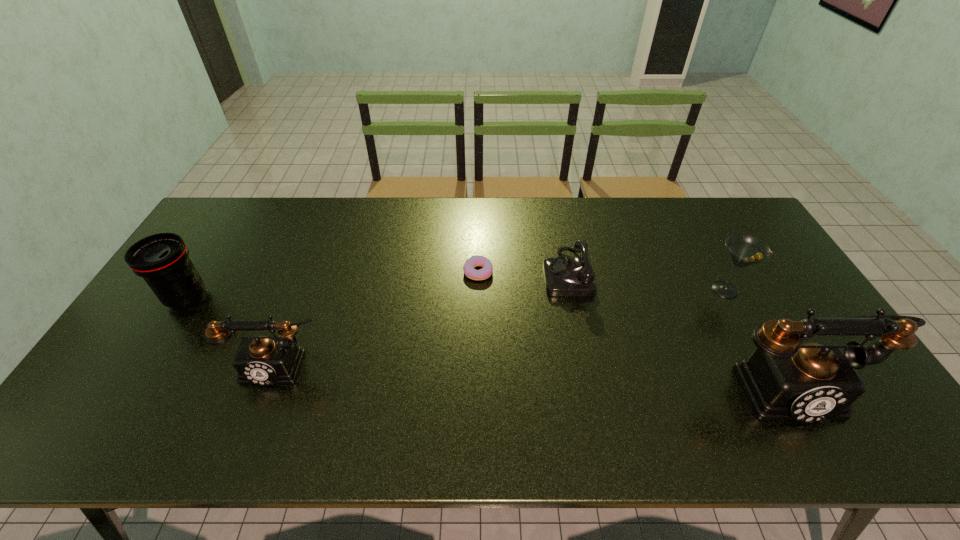
In the image, there is a desktop. Where is `vacant area at the far edge`? The width and height of the screenshot is (960, 540). vacant area at the far edge is located at coordinates (312, 225).

Image resolution: width=960 pixels, height=540 pixels. Find the location of `free space at the near edge`. free space at the near edge is located at coordinates (222, 386).

Find the location of a particular element. free space at the right edge of the desktop is located at coordinates (782, 310).

This screenshot has height=540, width=960. What are the coordinates of `free space at the far left corner of the desktop` in the screenshot? It's located at (211, 229).

Where is `vacant space in between the leftmost telephone and the rightmost telephone`? Image resolution: width=960 pixels, height=540 pixels. vacant space in between the leftmost telephone and the rightmost telephone is located at coordinates (533, 374).

In order to click on vacant area that lies between the leftmost telephone and the shortest telephone in this screenshot , I will do `click(422, 318)`.

Find the location of `free space between the second shortest telephone and the shortest object`. free space between the second shortest telephone and the shortest object is located at coordinates (378, 317).

Find the location of `free spot between the fourth object from left to right and the martini`. free spot between the fourth object from left to right and the martini is located at coordinates (646, 281).

Where is `vacant space that is in between the second object from left to right and the rightmost telephone`? vacant space that is in between the second object from left to right and the rightmost telephone is located at coordinates (533, 374).

At what (x,y) coordinates should I click in order to perform the action: click on free spot between the tallest telephone and the fifth tallest object. Please return your answer as a coordinate pair (x, y). The height and width of the screenshot is (540, 960). Looking at the image, I should click on (678, 328).